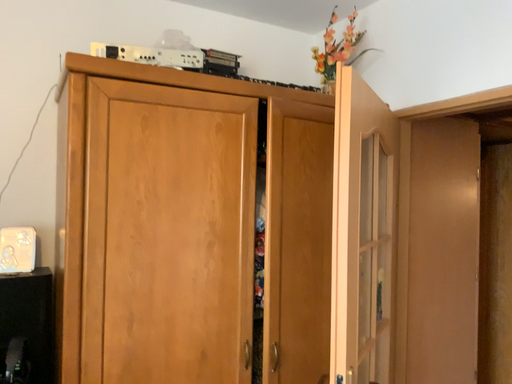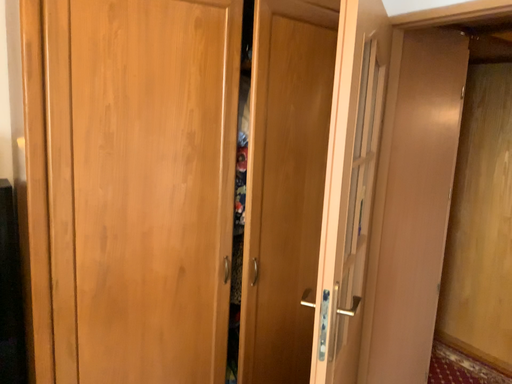
Question: How did the camera likely rotate when shooting the video?

Choices:
 (A) rotated downward
 (B) rotated upward

Answer: (A)